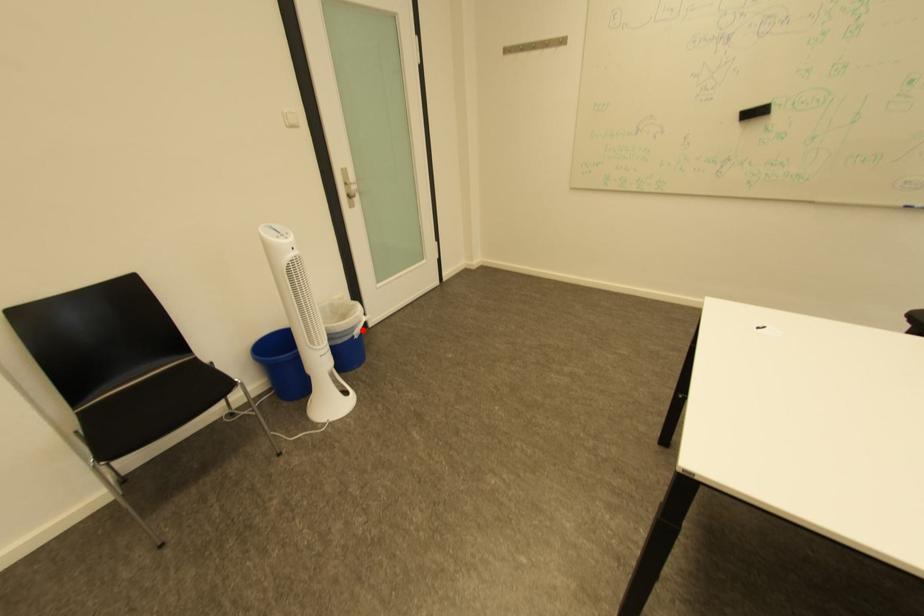
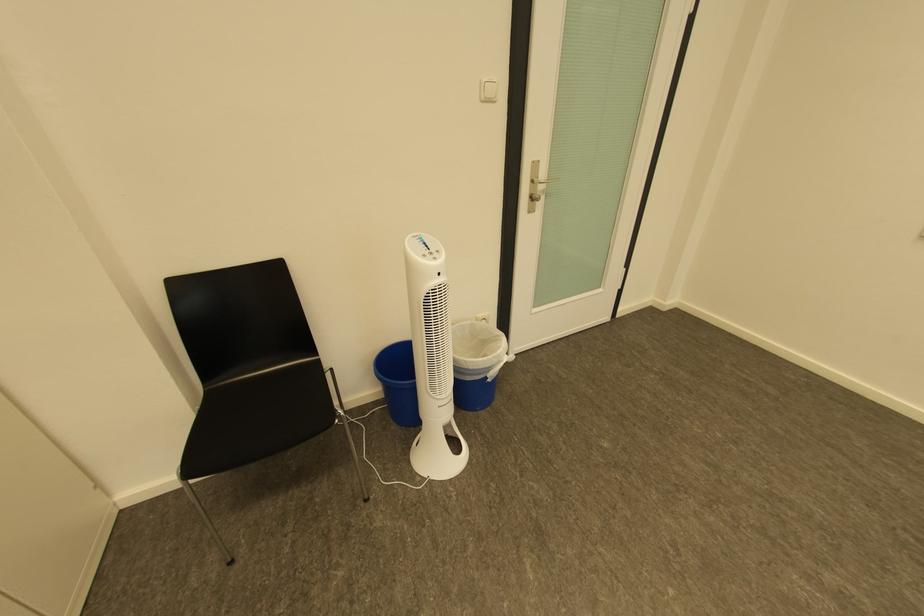
Find the pixel in the second image that matches the highlighted location in the first image.

(499, 370)